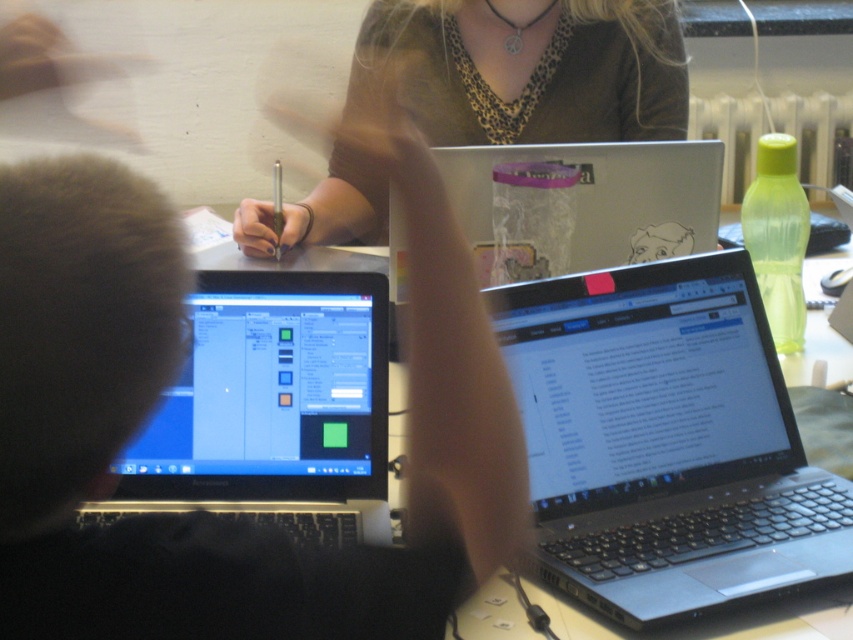
Is black matte laptop at center smaller than matte black laptop at center?

Actually, black matte laptop at center might be larger than matte black laptop at center.

Which is in front, point (781, 481) or point (242, 298)?

Point (242, 298) is more forward.

I want to click on black matte laptop at center, so click(x=665, y=442).

How distant is black matte laptop at left from matte black laptop at upper center?

black matte laptop at left and matte black laptop at upper center are 99.42 centimeters apart.

Based on the photo, is black matte laptop at left positioned in front of matte black laptop at upper center?

Yes.

From the picture: Who is more distant from viewer, (357, 580) or (573, 38)?

The point (573, 38) is more distant.

Image resolution: width=853 pixels, height=640 pixels. I want to click on black matte laptop at left, so click(x=167, y=381).

Does point (677, 113) come farther from viewer compared to point (202, 339)?

Yes, point (677, 113) is farther from viewer.

You are a GUI agent. You are given a task and a screenshot of the screen. Output one action in this format:
    pyautogui.click(x=<x>, y=<y>)
    Task: Click on the matte black laptop at upper center
    This screenshot has width=853, height=640.
    Given the screenshot: What is the action you would take?
    pyautogui.click(x=525, y=68)